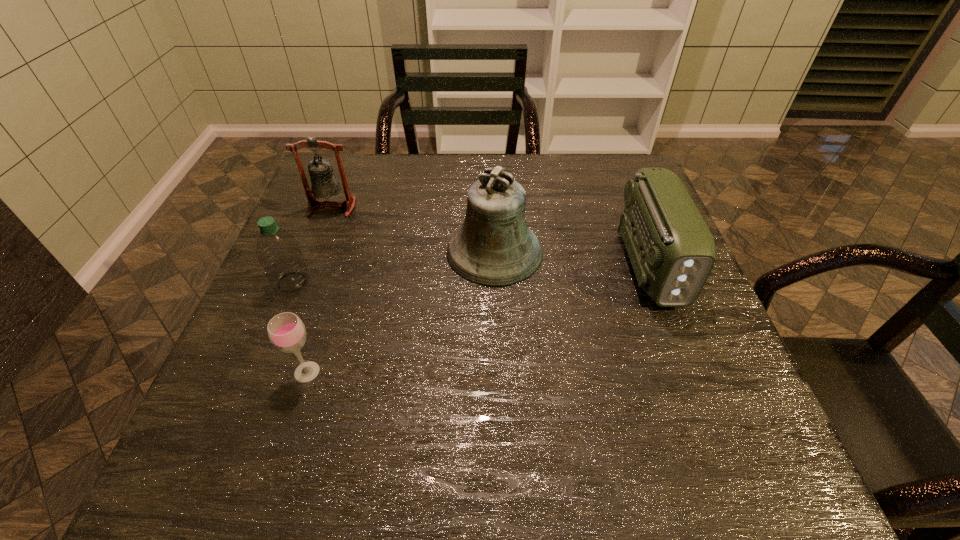
Identify the location of free region located on the front-facing side of the radio_receiver. (683, 349).

I want to click on vacant position located on the front of the water bottle, so click(x=261, y=359).

You are a GUI agent. You are given a task and a screenshot of the screen. Output one action in this format:
    pyautogui.click(x=<x>, y=<y>)
    Task: Click on the free spot located 0.170m on the back of the shortest object
    
    Given the screenshot: What is the action you would take?
    pyautogui.click(x=331, y=293)

Where is `object that is at the far edge`? The width and height of the screenshot is (960, 540). object that is at the far edge is located at coordinates click(324, 184).

Identify the location of bell at the left edge. (324, 184).

Locate an element on the screen. The width and height of the screenshot is (960, 540). water bottle that is at the left edge is located at coordinates (278, 252).

Image resolution: width=960 pixels, height=540 pixels. I want to click on wineglass that is at the left edge, so click(x=286, y=331).

This screenshot has width=960, height=540. What are the coordinates of `object positioned at the right edge` in the screenshot? It's located at (672, 251).

Locate an element on the screen. This screenshot has width=960, height=540. object at the far left corner is located at coordinates (324, 184).

Image resolution: width=960 pixels, height=540 pixels. Identify the location of vacant space at the far edge. (543, 161).